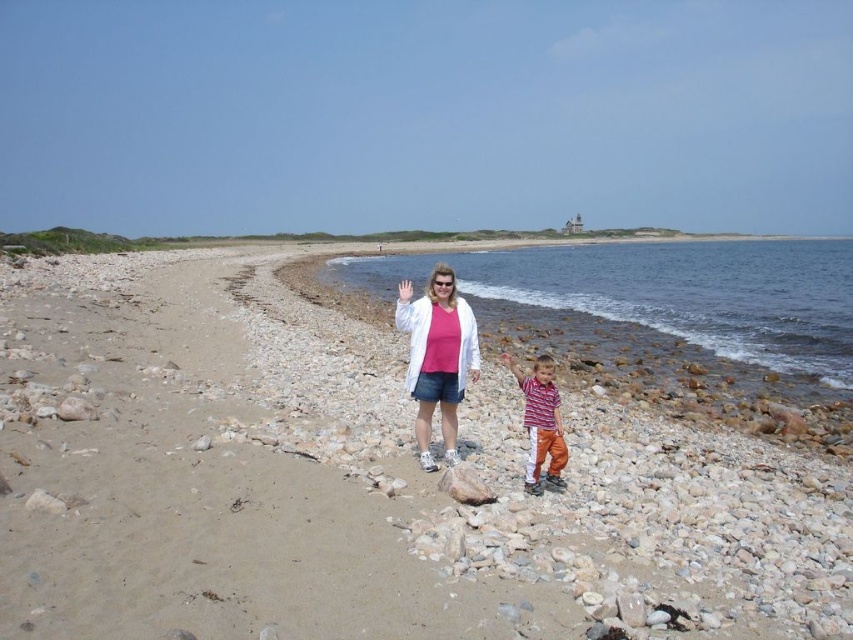
Question: Considering the real-world distances, which object is closest to the smooth pebbles at center?

Choices:
 (A) striped cotton shirt at center
 (B) matte white jacket at center

Answer: (B)

Question: Does smooth pebbles at center appear over matte white jacket at center?

Choices:
 (A) yes
 (B) no

Answer: (A)

Question: Does smooth pebbles at center appear on the right side of matte white jacket at center?

Choices:
 (A) no
 (B) yes

Answer: (A)

Question: Which object is closer to the camera taking this photo?

Choices:
 (A) smooth pebbles at center
 (B) striped cotton shirt at center
 (C) matte white jacket at center

Answer: (A)

Question: Does smooth pebbles at center appear over striped cotton shirt at center?

Choices:
 (A) yes
 (B) no

Answer: (A)

Question: Which point is farther to the camera?

Choices:
 (A) striped cotton shirt at center
 (B) smooth pebbles at center

Answer: (A)